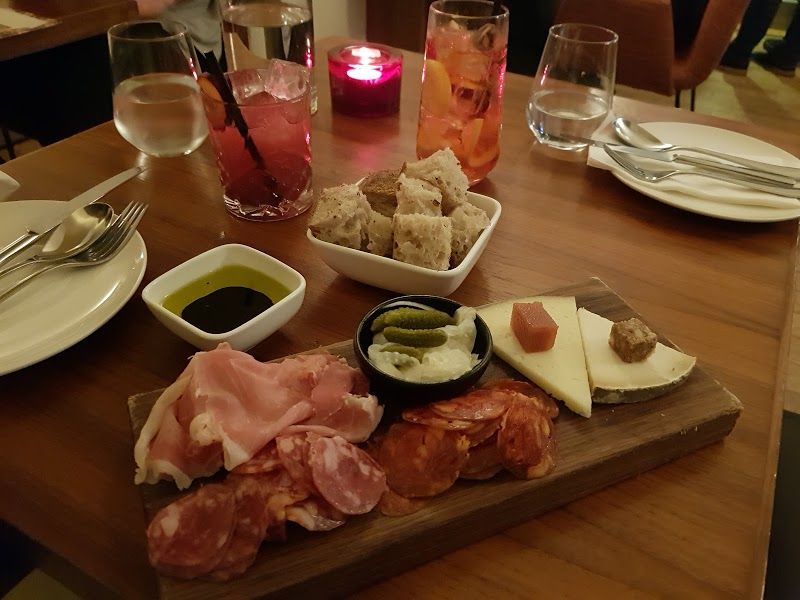
In order to click on fork in this screenshot , I will do `click(93, 255)`, `click(650, 175)`.